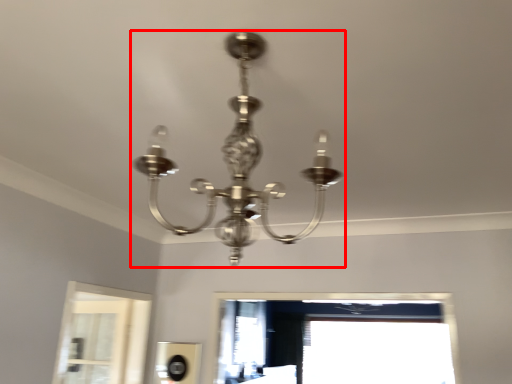
Question: Where is lamp (annotated by the red box) located in relation to window in the image?

Choices:
 (A) left
 (B) right

Answer: (A)